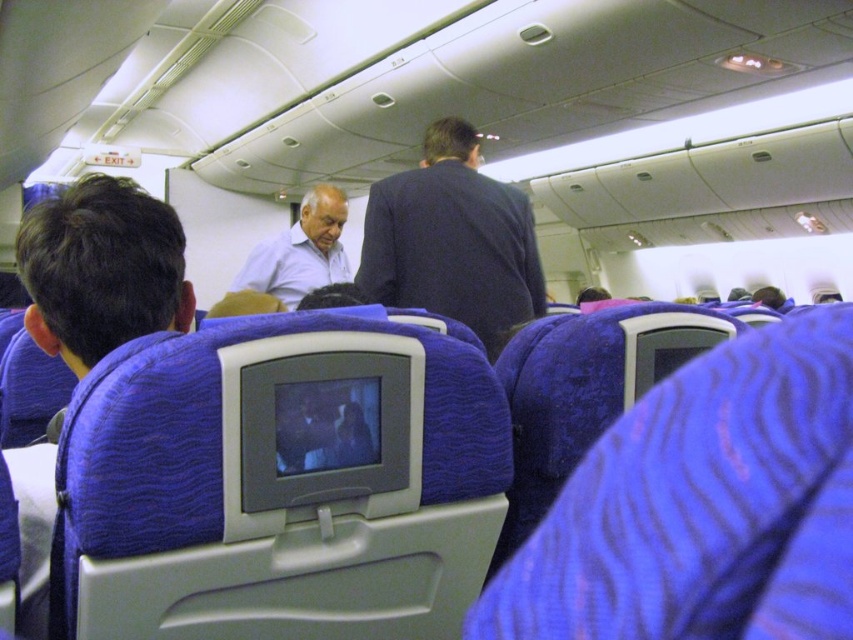
Image resolution: width=853 pixels, height=640 pixels. Describe the element at coordinates (102, 269) in the screenshot. I see `blue fabric shirt at left` at that location.

Does blue fabric shirt at left appear on the right side of light blue shirt at center?

No, blue fabric shirt at left is not to the right of light blue shirt at center.

Does point (94, 355) come behind point (254, 284)?

No, (94, 355) is in front of (254, 284).

Locate an element on the screen. blue fabric shirt at left is located at coordinates (102, 269).

Who is positioned more to the left, dark blue suit at center or light blue shirt at center?

Positioned to the left is light blue shirt at center.

Where is `dark blue suit at center`? This screenshot has height=640, width=853. dark blue suit at center is located at coordinates (453, 241).

Between point (524, 240) and point (270, 241), which one is positioned behind?

Point (270, 241)

Where is `dark blue suit at center`? This screenshot has width=853, height=640. dark blue suit at center is located at coordinates (453, 241).

Between point (489, 218) and point (148, 288), which one is positioned in front?

Positioned in front is point (148, 288).

Can you confirm if dark blue suit at center is positioned to the left of blue fabric shirt at left?

No, dark blue suit at center is not to the left of blue fabric shirt at left.

Is point (416, 189) positioned in front of point (113, 326)?

No, it is behind (113, 326).

Locate an element on the screen. dark blue suit at center is located at coordinates (x=453, y=241).